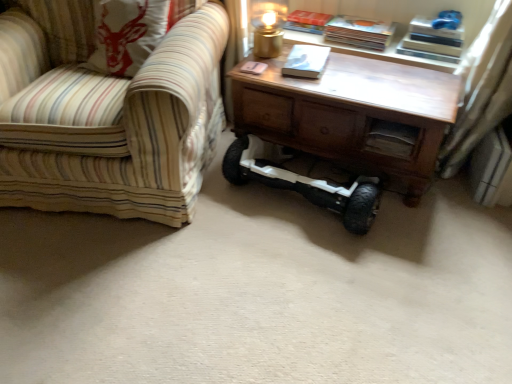
Find the location of a particular element. This screenshot has height=384, width=512. vacant area situated below white matte book at center, marked as the first book in a front-to-back arrangement (from a real-world perspective) is located at coordinates (304, 66).